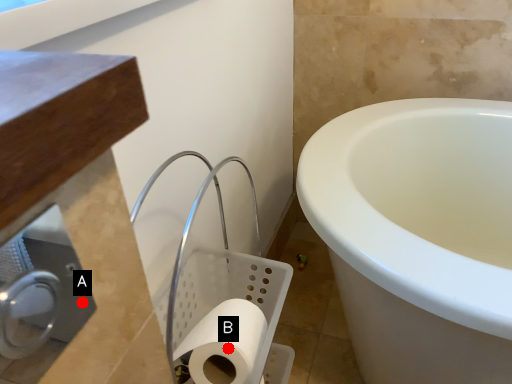
Question: Two points are circled on the image, labeled by A and B beside each circle. Which of the following is the farthest from the observer?

Choices:
 (A) A is further
 (B) B is further

Answer: (A)